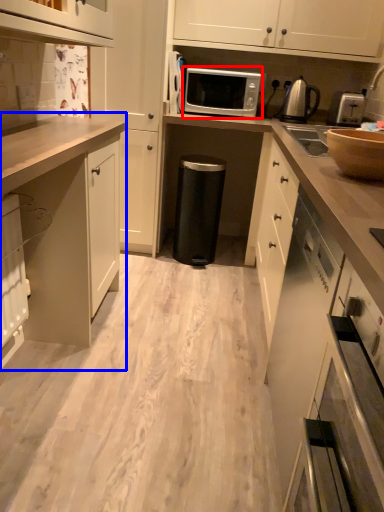
Question: Among these objects, which one is farthest to the camera, microwave oven (highlighted by a red box) or cabinetry (highlighted by a blue box)?

Choices:
 (A) microwave oven
 (B) cabinetry

Answer: (A)